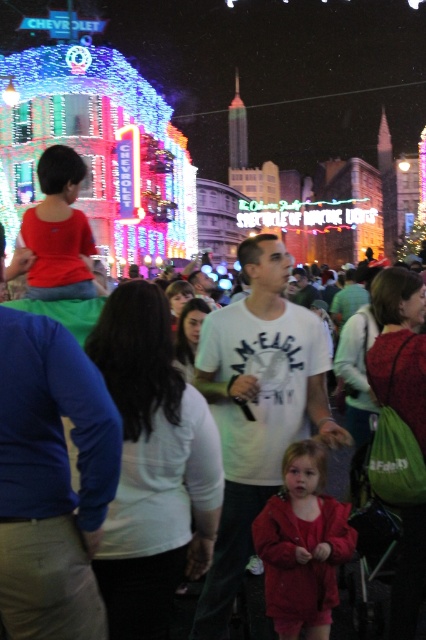
Question: Does white cotton shirt at center have a smaller size compared to matte red coat at center?

Choices:
 (A) no
 (B) yes

Answer: (A)

Question: Is white cotton shirt at center smaller than matte red coat at center?

Choices:
 (A) yes
 (B) no

Answer: (B)

Question: Can you confirm if white cotton shirt at center is thinner than matte red coat at center?

Choices:
 (A) yes
 (B) no

Answer: (B)

Question: Which point appears closest to the camera in this image?

Choices:
 (A) (247, 304)
 (B) (273, 566)

Answer: (B)

Question: Among these objects, which one is farthest from the camera?

Choices:
 (A) matte red coat at center
 (B) white cotton shirt at center

Answer: (A)